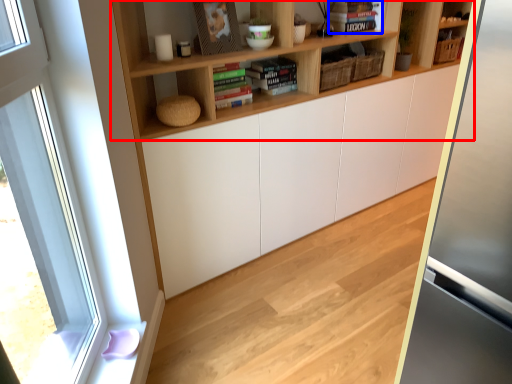
Question: Which of the following is the farthest to the observer, shelf (highlighted by a red box) or book (highlighted by a blue box)?

Choices:
 (A) shelf
 (B) book

Answer: (B)